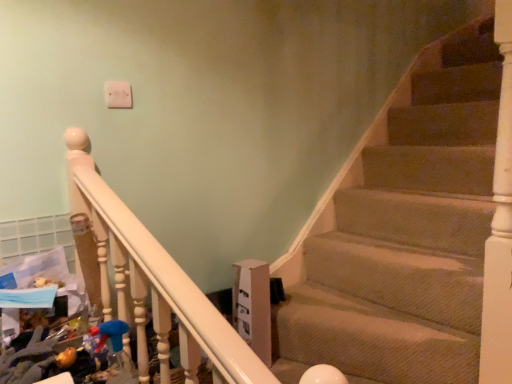
The image size is (512, 384). In order to click on white glossy rail at upper left in this screenshot , I will do `click(152, 283)`.

What do you see at coordinates (152, 283) in the screenshot?
I see `white glossy rail at upper left` at bounding box center [152, 283].

Identify the location of white glossy rail at upper left. 152,283.